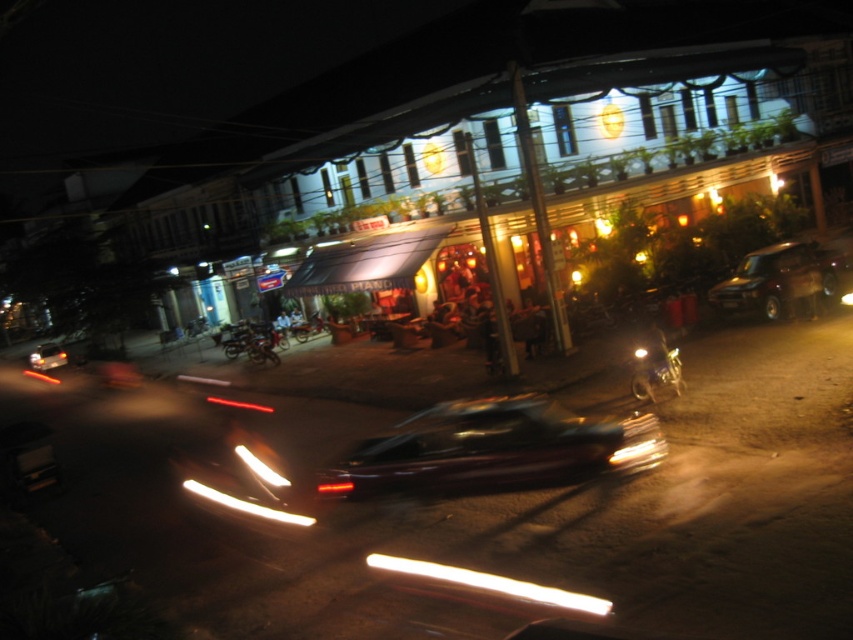
You are standing at the center of the street and see the point marked as point (492,448). What object does this point correspond to?

The point (492,448) corresponds to the shiny dark car at center.